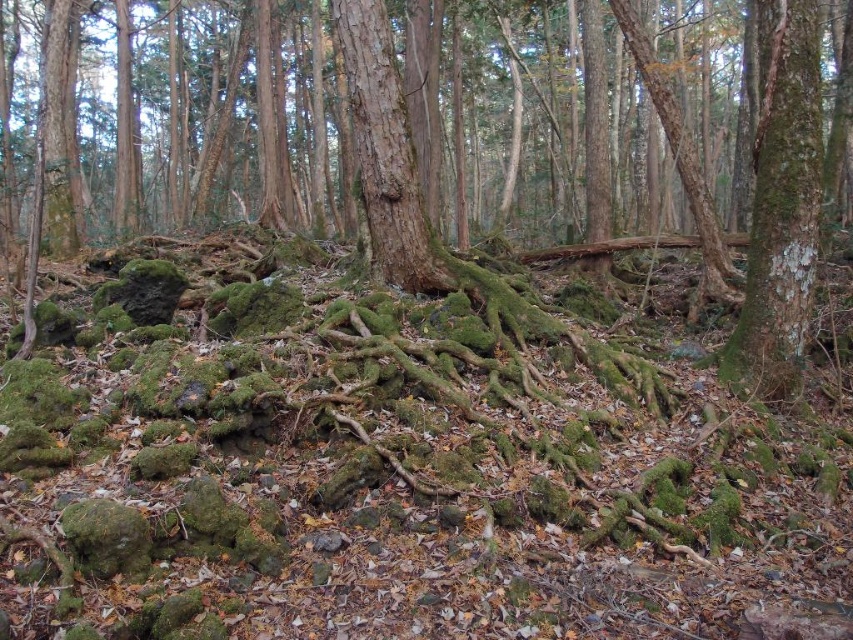
Question: Which point is closer to the camera?

Choices:
 (A) (360, 51)
 (B) (770, 218)

Answer: (B)

Question: Considering the real-world distances, which object is closest to the green mossy bark tree trunk at right?

Choices:
 (A) green mossy roots at center
 (B) brown rough tree trunk at center

Answer: (B)

Question: Is green mossy roots at center below brown rough tree trunk at center?

Choices:
 (A) yes
 (B) no

Answer: (B)

Question: Which object appears farthest from the camera in this image?

Choices:
 (A) green mossy roots at center
 (B) brown rough tree trunk at center

Answer: (B)

Question: Can you confirm if green mossy bark tree trunk at right is bigger than brown rough tree trunk at center?

Choices:
 (A) no
 (B) yes

Answer: (B)

Question: Does green mossy roots at center appear on the right side of brown rough tree trunk at center?

Choices:
 (A) no
 (B) yes

Answer: (B)